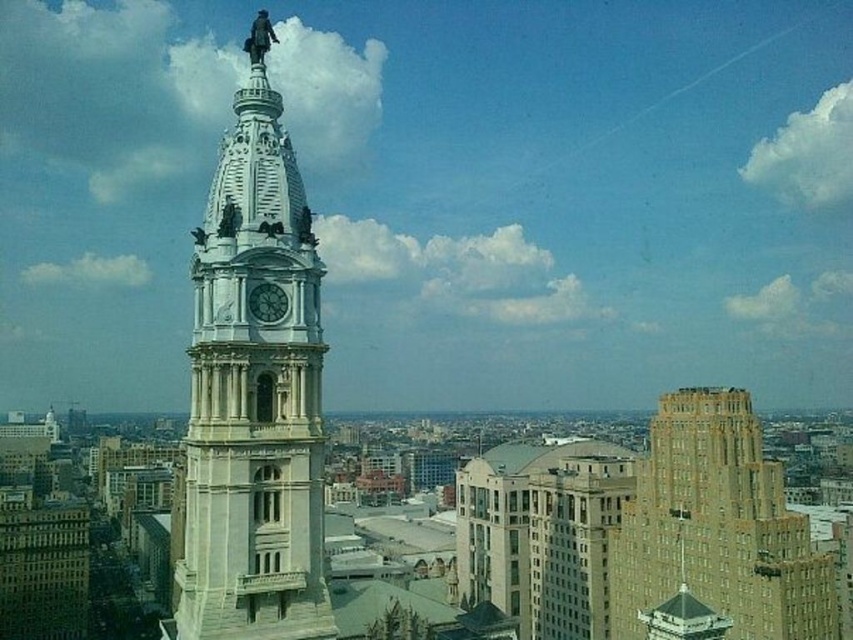
Question: Which object is closer to the camera taking this photo?

Choices:
 (A) white stone clock tower at center
 (B) white marble clock at center

Answer: (A)

Question: Is brown brick building at center-right to the right of white marble clock at center from the viewer's perspective?

Choices:
 (A) yes
 (B) no

Answer: (A)

Question: Which is farther from the brown brick building at center-right?

Choices:
 (A) white marble clock at center
 (B) white stone clock tower at center

Answer: (B)

Question: Among these objects, which one is nearest to the camera?

Choices:
 (A) white marble clock at center
 (B) white stone clock tower at center

Answer: (B)

Question: Can you confirm if brown brick building at center-right is positioned to the right of white marble clock at center?

Choices:
 (A) no
 (B) yes

Answer: (B)

Question: Does white stone clock tower at center appear under brown brick building at center-right?

Choices:
 (A) no
 (B) yes

Answer: (A)